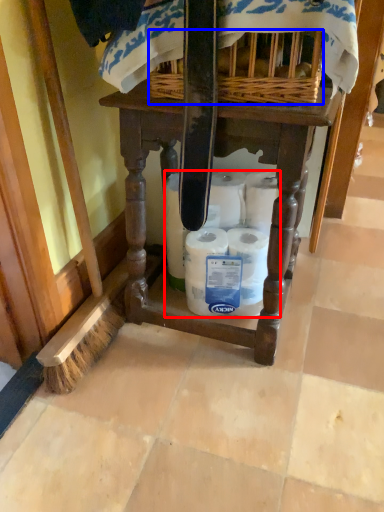
Question: Which of the following is the farthest to the observer, toilet paper (highlighted by a red box) or basket (highlighted by a blue box)?

Choices:
 (A) toilet paper
 (B) basket

Answer: (A)